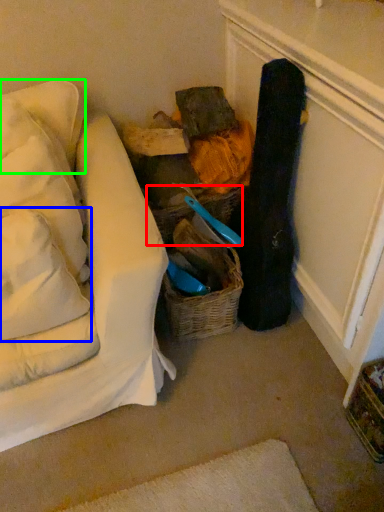
Question: Considering the real-world distances, which object is closest to basket (highlighted by a red box)? pillow (highlighted by a blue box) or pillow (highlighted by a green box).

Choices:
 (A) pillow
 (B) pillow

Answer: (B)